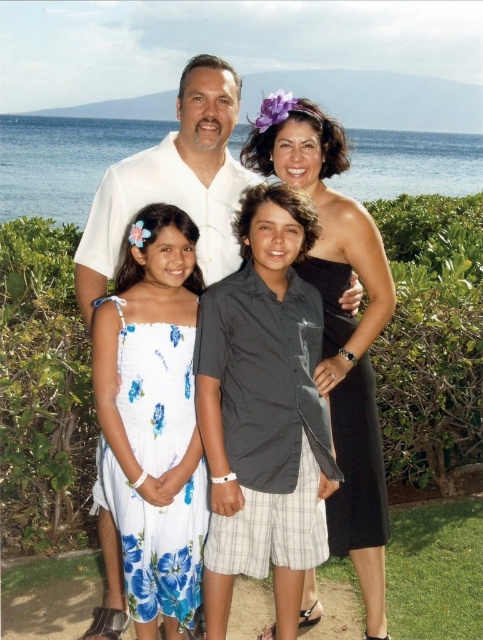
The width and height of the screenshot is (483, 640). Describe the element at coordinates (264, 412) in the screenshot. I see `dark gray satin shirt at center` at that location.

Who is higher up, dark gray satin shirt at center or white floral dress at center?

Positioned higher is dark gray satin shirt at center.

Locate an element on the screen. Image resolution: width=483 pixels, height=640 pixels. dark gray satin shirt at center is located at coordinates (264, 412).

Image resolution: width=483 pixels, height=640 pixels. What do you see at coordinates (264, 412) in the screenshot?
I see `dark gray satin shirt at center` at bounding box center [264, 412].

Can you confirm if dark gray satin shirt at center is shorter than black satin dress at center?

Yes, dark gray satin shirt at center is shorter than black satin dress at center.

Is point (209, 380) positioned behind point (343, 220)?

No.

The image size is (483, 640). Find the location of `dark gray satin shirt at center`. dark gray satin shirt at center is located at coordinates (264, 412).

I want to click on white floral dress at center, so click(x=154, y=419).

Describe the element at coordinates (154, 419) in the screenshot. I see `white floral dress at center` at that location.

The height and width of the screenshot is (640, 483). What are the coordinates of `white floral dress at center` in the screenshot? It's located at (154, 419).